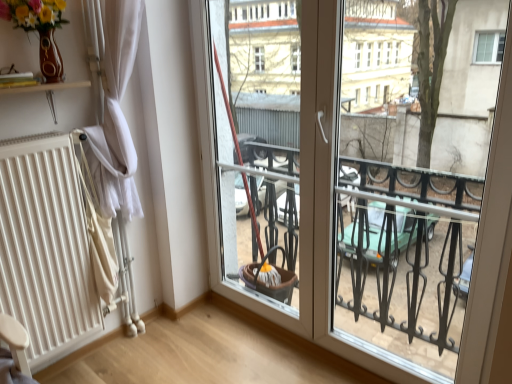
Question: Considering the positions of matte brown vase at upper left and white matte radiator at left in the image, is matte brown vase at upper left taller or shorter than white matte radiator at left?

Choices:
 (A) tall
 (B) short

Answer: (B)

Question: Would you say matte brown vase at upper left is inside or outside white matte radiator at left?

Choices:
 (A) outside
 (B) inside

Answer: (A)

Question: Estimate the real-world distances between objects in this image. Which object is closer to the white fabric curtain at left?

Choices:
 (A) matte brown vase at upper left
 (B) white matte radiator at left

Answer: (A)

Question: Estimate the real-world distances between objects in this image. Which object is closer to the matte brown vase at upper left?

Choices:
 (A) white matte radiator at left
 (B) white fabric curtain at left

Answer: (B)